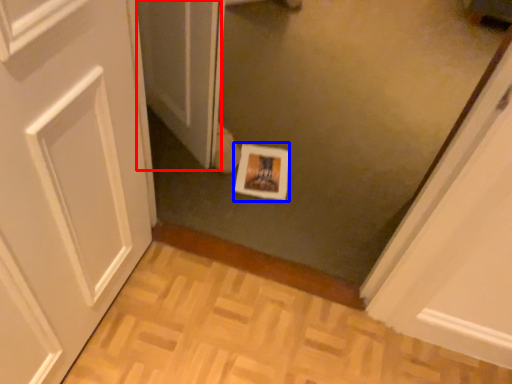
Question: Which of the following is the closest to the observer, screen door (highlighted by a red box) or print (highlighted by a blue box)?

Choices:
 (A) screen door
 (B) print

Answer: (A)